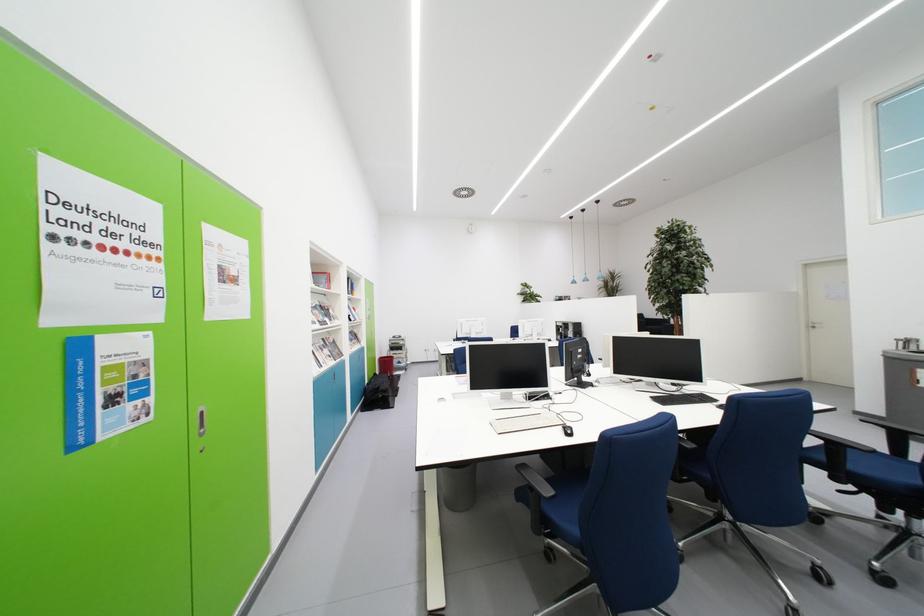
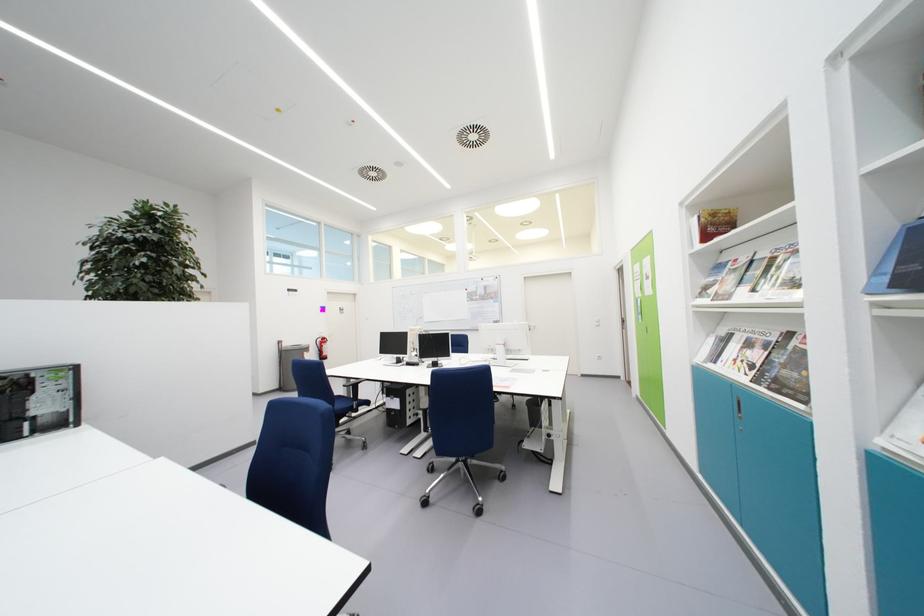
Question: I am providing you with two images of the same scene from different viewpoints. After the viewpoint changes to image2, which objects are now occluded?

Choices:
 (A) green utensil
 (B) magazine
 (C) blue chair sitting surface
 (D) black chair armrest

Answer: (D)